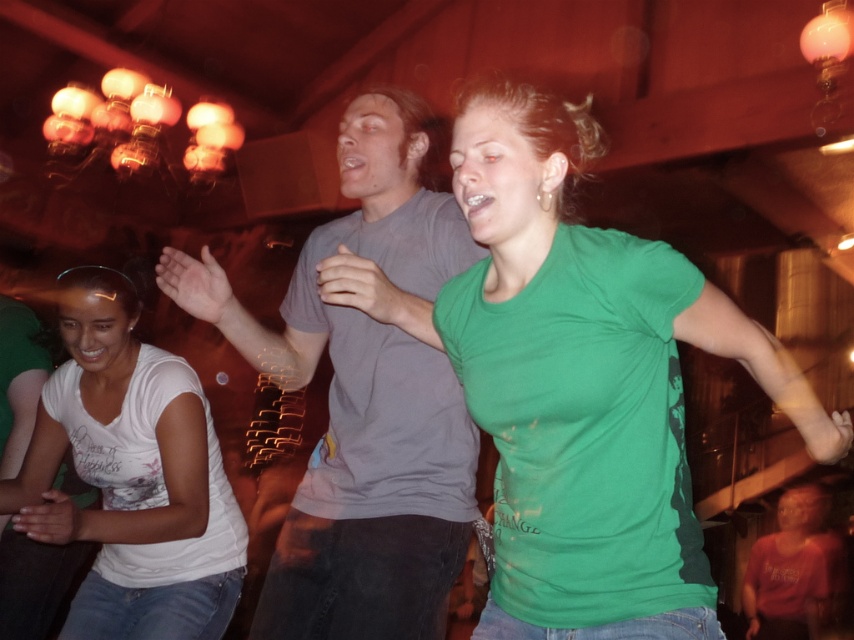
Question: Is the position of green matte t-shirt at center more distant than that of white cotton shirt at lower left?

Choices:
 (A) yes
 (B) no

Answer: (B)

Question: Can you confirm if green matte t-shirt at center is positioned to the left of gray matte t-shirt at center?

Choices:
 (A) no
 (B) yes

Answer: (A)

Question: Which object is farther from the camera taking this photo?

Choices:
 (A) white cotton shirt at lower left
 (B) green matte t-shirt at center
 (C) gray matte t-shirt at center

Answer: (A)

Question: Based on their relative distances, which object is nearer to the white cotton shirt at lower left?

Choices:
 (A) green matte t-shirt at center
 (B) gray matte t-shirt at center

Answer: (B)

Question: Based on their relative distances, which object is nearer to the gray matte t-shirt at center?

Choices:
 (A) green matte t-shirt at center
 (B) white cotton shirt at lower left

Answer: (A)

Question: Is green matte t-shirt at center above gray matte t-shirt at center?

Choices:
 (A) no
 (B) yes

Answer: (B)